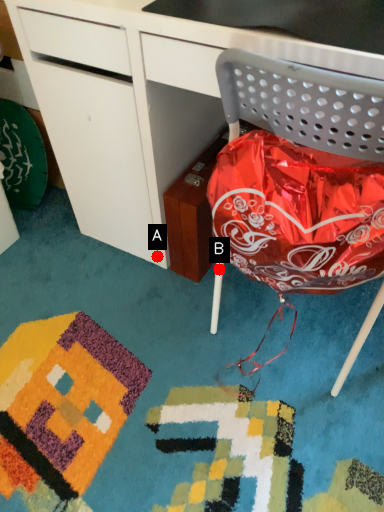
Question: Two points are circled on the image, labeled by A and B beside each circle. Which point is farther from the camera taking this photo?

Choices:
 (A) A is further
 (B) B is further

Answer: (A)